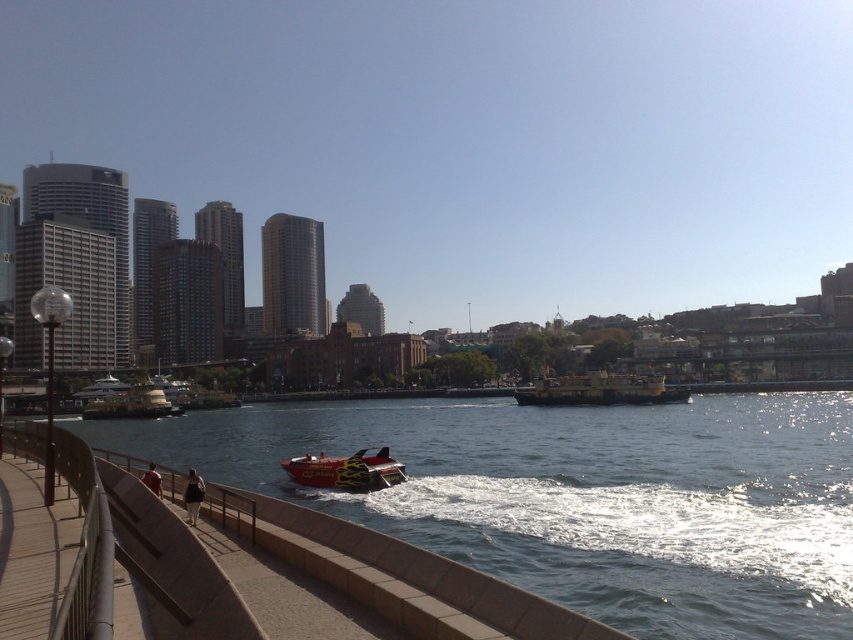
Does smooth concrete walkway at lower left have a lesser width compared to yellow polished ferry at center?

In fact, smooth concrete walkway at lower left might be wider than yellow polished ferry at center.

Is smooth concrete walkway at lower left above yellow polished ferry at center?

Actually, smooth concrete walkway at lower left is below yellow polished ferry at center.

Find the location of a particular element. The height and width of the screenshot is (640, 853). smooth concrete walkway at lower left is located at coordinates (579, 497).

Which is more to the left, yellow polished ferry at center or flame-painted fiberglass speedboat at center?

flame-painted fiberglass speedboat at center is more to the left.

Is point (637, 392) positioned after point (368, 467)?

Yes, it is.

Is point (622, 396) in front of point (355, 472)?

No, (622, 396) is behind (355, 472).

Identify the location of yellow polished ferry at center. (601, 390).

Can you confirm if yellow polished ferry at center is positioned to the right of yellow metallic ferry at left?

Correct, you'll find yellow polished ferry at center to the right of yellow metallic ferry at left.

Describe the element at coordinates (601, 390) in the screenshot. I see `yellow polished ferry at center` at that location.

Does point (520, 397) come closer to viewer compared to point (107, 396)?

Yes, it is in front of point (107, 396).

The width and height of the screenshot is (853, 640). I want to click on yellow polished ferry at center, so click(x=601, y=390).